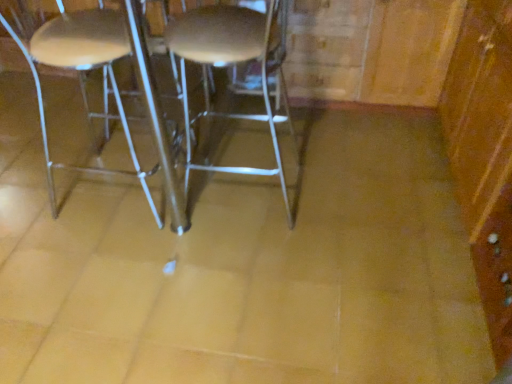
Question: Is wooden dresser at right not inside metallic silver stool at left?

Choices:
 (A) no
 (B) yes

Answer: (B)

Question: From a real-world perspective, is wooden dresser at right located beneath metallic silver stool at left?

Choices:
 (A) yes
 (B) no

Answer: (A)

Question: Considering the relative sizes of wooden dresser at right and metallic silver stool at left in the image provided, is wooden dresser at right smaller than metallic silver stool at left?

Choices:
 (A) no
 (B) yes

Answer: (A)

Question: From the image's perspective, does wooden dresser at right appear lower than metallic silver stool at left?

Choices:
 (A) yes
 (B) no

Answer: (B)

Question: Considering the relative positions of wooden dresser at right and metallic silver stool at left in the image provided, is wooden dresser at right to the left of metallic silver stool at left from the viewer's perspective?

Choices:
 (A) yes
 (B) no

Answer: (B)

Question: From a real-world perspective, is wooden dresser at right positioned over metallic silver stool at left based on gravity?

Choices:
 (A) no
 (B) yes

Answer: (A)

Question: Considering the relative positions of metallic silver stool at center and metallic silver stool at left in the image provided, is metallic silver stool at center behind metallic silver stool at left?

Choices:
 (A) no
 (B) yes

Answer: (A)

Question: Considering the relative sizes of metallic silver stool at center and metallic silver stool at left in the image provided, is metallic silver stool at center bigger than metallic silver stool at left?

Choices:
 (A) yes
 (B) no

Answer: (A)

Question: Is metallic silver stool at left inside metallic silver stool at center?

Choices:
 (A) yes
 (B) no

Answer: (B)

Question: Does metallic silver stool at center appear on the left side of metallic silver stool at left?

Choices:
 (A) no
 (B) yes

Answer: (A)

Question: Are metallic silver stool at center and metallic silver stool at left making contact?

Choices:
 (A) yes
 (B) no

Answer: (B)

Question: Is metallic silver stool at center not near metallic silver stool at left?

Choices:
 (A) no
 (B) yes

Answer: (A)

Question: Considering the relative sizes of wooden dresser at right and metallic silver stool at center in the image provided, is wooden dresser at right taller than metallic silver stool at center?

Choices:
 (A) yes
 (B) no

Answer: (B)